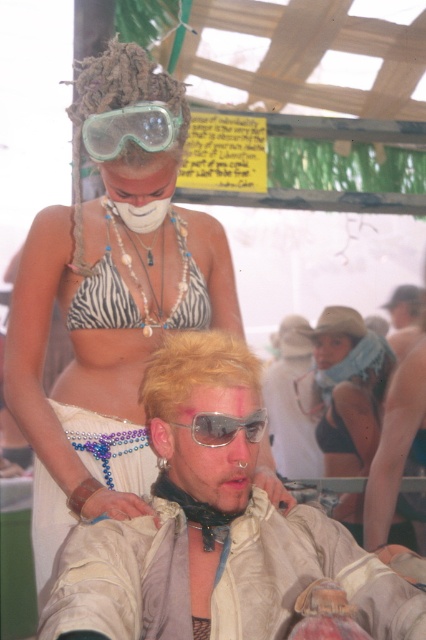
Between zebra print bikini top at upper left and transparent plastic goggles at upper center, which one is positioned lower?

zebra print bikini top at upper left is below.

Which is more to the left, zebra print bikini top at upper left or transparent plastic goggles at upper center?

transparent plastic goggles at upper center is more to the left.

Is point (54, 500) positioned before point (176, 131)?

No.

Identify the location of zebra print bikini top at upper left. (106, 321).

Is transparent plastic goggles at upper center taller than white matte mask at center?

No.

Who is positioned more to the left, transparent plastic goggles at upper center or white matte mask at center?

white matte mask at center

Is point (180, 116) less distant than point (164, 209)?

That is True.

Where is `transparent plastic goggles at upper center`? The width and height of the screenshot is (426, 640). transparent plastic goggles at upper center is located at coordinates (131, 129).

Who is more forward, (132,115) or (261,436)?

Point (261,436)

Locate an element on the screen. This screenshot has height=640, width=426. transparent plastic goggles at upper center is located at coordinates (131, 129).